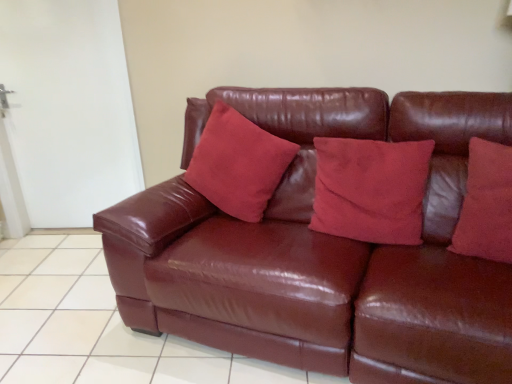
The width and height of the screenshot is (512, 384). Describe the element at coordinates (486, 204) in the screenshot. I see `suede-like red pillow at right, the third pillow from the left` at that location.

The image size is (512, 384). Describe the element at coordinates (323, 250) in the screenshot. I see `shiny brown leather couch at center` at that location.

What is the approximate height of suede-like red pillow at center, the second pillow in the left-to-right sequence?

21.82 inches.

You are a GUI agent. You are given a task and a screenshot of the screen. Output one action in this format:
    pyautogui.click(x=<x>, y=<y>)
    Task: Click on the suede-like red pillow at right, which is counted as the 1th pillow, starting from the right
    The width and height of the screenshot is (512, 384).
    Given the screenshot: What is the action you would take?
    pyautogui.click(x=486, y=204)

Is shiny brown leather couch at center to the right of suede-like red pillow at right, which is counted as the 1th pillow, starting from the right, from the viewer's perspective?

In fact, shiny brown leather couch at center is to the left of suede-like red pillow at right, which is counted as the 1th pillow, starting from the right.

From a real-world perspective, which object stands above the other?

suede-like red pillow at right, the third pillow from the left, is physically above.

Could you tell me if shiny brown leather couch at center is facing suede-like red pillow at right, the third pillow from the left?

No, shiny brown leather couch at center is not aimed at suede-like red pillow at right, the third pillow from the left.

Considering the sizes of objects shiny brown leather couch at center and suede-like red pillow at right, the third pillow from the left, in the image provided, who is bigger, shiny brown leather couch at center or suede-like red pillow at right, the third pillow from the left,?

With larger size is shiny brown leather couch at center.

Is glossy leather couch at center wider than suede-like red pillow at center, the 3th pillow when ordered from right to left?

Correct, the width of glossy leather couch at center exceeds that of suede-like red pillow at center, the 3th pillow when ordered from right to left.

Looking at this image, in terms of height, does glossy leather couch at center look taller or shorter compared to suede-like red pillow at center, the 3th pillow when ordered from right to left?

Considering their sizes, glossy leather couch at center has less height than suede-like red pillow at center, the 3th pillow when ordered from right to left.

Is suede-like red pillow at center, arranged as the 1th pillow when viewed from the left, a part of shiny brown leather couch at center?

Absolutely, suede-like red pillow at center, arranged as the 1th pillow when viewed from the left, is inside shiny brown leather couch at center.

From a real-world perspective, which object rests below the other?

shiny brown leather couch at center is physically lower.

Considering the sizes of objects shiny brown leather couch at center and suede-like red pillow at center, the 3th pillow when ordered from right to left, in the image provided, who is shorter, shiny brown leather couch at center or suede-like red pillow at center, the 3th pillow when ordered from right to left,?

suede-like red pillow at center, the 3th pillow when ordered from right to left, is shorter.

Between shiny brown leather couch at center and suede-like red pillow at center, arranged as the 1th pillow when viewed from the left, which one has smaller width?

Thinner between the two is suede-like red pillow at center, arranged as the 1th pillow when viewed from the left.

Does shiny brown leather couch at center have a lesser height compared to glossy leather couch at center?

No, shiny brown leather couch at center is not shorter than glossy leather couch at center.

Is shiny brown leather couch at center wider or thinner than glossy leather couch at center?

Considering their sizes, shiny brown leather couch at center looks slimmer than glossy leather couch at center.

In the scene shown: Between shiny brown leather couch at center and glossy leather couch at center, which one is positioned behind?

glossy leather couch at center is more distant.

From the picture: Can you confirm if shiny brown leather couch at center is positioned to the left of glossy leather couch at center?

No.

Considering the relative sizes of suede-like red pillow at right, which is counted as the 1th pillow, starting from the right, and glossy leather couch at center in the image provided, is suede-like red pillow at right, which is counted as the 1th pillow, starting from the right, bigger than glossy leather couch at center?

Incorrect, suede-like red pillow at right, which is counted as the 1th pillow, starting from the right, is not larger than glossy leather couch at center.

In the image, is suede-like red pillow at right, the third pillow from the left, on the left side or the right side of glossy leather couch at center?

suede-like red pillow at right, the third pillow from the left, is to the right of glossy leather couch at center.

Is glossy leather couch at center at the back of suede-like red pillow at right, which is counted as the 1th pillow, starting from the right?

No.

Who is taller, suede-like red pillow at right, which is counted as the 1th pillow, starting from the right, or glossy leather couch at center?

Standing taller between the two is suede-like red pillow at right, which is counted as the 1th pillow, starting from the right.

Where is `studio couch located on the left of suede-like red pillow at right, the third pillow from the left`? The image size is (512, 384). studio couch located on the left of suede-like red pillow at right, the third pillow from the left is located at coordinates (323, 250).

Is suede-like red pillow at right, which is counted as the 1th pillow, starting from the right, facing away from shiny brown leather couch at center?

Yes, suede-like red pillow at right, which is counted as the 1th pillow, starting from the right,'s orientation is away from shiny brown leather couch at center.

How many degrees apart are the facing directions of suede-like red pillow at right, which is counted as the 1th pillow, starting from the right, and shiny brown leather couch at center?

They differ by 0.923 degrees in their facing directions.

How many degrees apart are the facing directions of suede-like red pillow at center, arranged as the 1th pillow when viewed from the left, and suede-like red pillow at center, the second pillow in the left-to-right sequence?

The angular difference between suede-like red pillow at center, arranged as the 1th pillow when viewed from the left, and suede-like red pillow at center, the second pillow in the left-to-right sequence, is 4.2 degrees.

From the picture: Which object is positioned more to the right, suede-like red pillow at center, the 3th pillow when ordered from right to left, or suede-like red pillow at center, the second pillow in the left-to-right sequence?

Positioned to the right is suede-like red pillow at center, the second pillow in the left-to-right sequence.

At what (x,y) coordinates should I click in order to perform the action: click on the 2nd pillow directly beneath the suede-like red pillow at center, the 3th pillow when ordered from right to left (from a real-world perspective). Please return your answer as a coordinate pair (x, y). The width and height of the screenshot is (512, 384). Looking at the image, I should click on (370, 189).

Does suede-like red pillow at center, the 3th pillow when ordered from right to left, come behind suede-like red pillow at center, the second pillow in the left-to-right sequence?

Yes, it is.

The image size is (512, 384). In order to click on pillow that is the 2nd object above the shiny brown leather couch at center (from a real-world perspective) in this screenshot , I will do `click(486, 204)`.

In order to click on tile lying below the suede-like red pillow at center, arranged as the 1th pillow when viewed from the left (from the image's perspective) in this screenshot , I will do `click(94, 326)`.

From the picture: When comparing their distances from suede-like red pillow at center, the second pillow in the left-to-right sequence, does suede-like red pillow at center, the 3th pillow when ordered from right to left, or glossy leather couch at center seem closer?

The object closer to suede-like red pillow at center, the second pillow in the left-to-right sequence, is suede-like red pillow at center, the 3th pillow when ordered from right to left.

Consider the image. Based on their spatial positions, is suede-like red pillow at center, the second pillow in the left-to-right sequence, or suede-like red pillow at center, arranged as the 1th pillow when viewed from the left, closer to shiny brown leather couch at center?

The object closer to shiny brown leather couch at center is suede-like red pillow at center, the second pillow in the left-to-right sequence.

Considering their positions, is glossy leather couch at center positioned closer to suede-like red pillow at center, arranged as the 1th pillow when viewed from the left, than suede-like red pillow at right, the third pillow from the left?

glossy leather couch at center is positioned closer to the anchor suede-like red pillow at center, arranged as the 1th pillow when viewed from the left.

Considering their positions, is shiny brown leather couch at center positioned further to suede-like red pillow at center, which is the second pillow from right to left, than glossy leather couch at center?

glossy leather couch at center lies further to suede-like red pillow at center, which is the second pillow from right to left, than the other object.

Based on their spatial positions, is suede-like red pillow at center, the second pillow in the left-to-right sequence, or shiny brown leather couch at center further from suede-like red pillow at center, arranged as the 1th pillow when viewed from the left?

suede-like red pillow at center, the second pillow in the left-to-right sequence.

Considering their positions, is suede-like red pillow at center, which is the second pillow from right to left, positioned further to shiny brown leather couch at center than glossy leather couch at center?

glossy leather couch at center.

From the image, which object appears to be farther from glossy leather couch at center, shiny brown leather couch at center or suede-like red pillow at right, the third pillow from the left?

Based on the image, suede-like red pillow at right, the third pillow from the left, appears to be further to glossy leather couch at center.

Based on their spatial positions, is glossy leather couch at center or suede-like red pillow at center, which is the second pillow from right to left, closer to shiny brown leather couch at center?

Among the two, suede-like red pillow at center, which is the second pillow from right to left, is located nearer to shiny brown leather couch at center.

The image size is (512, 384). In order to click on pillow between suede-like red pillow at center, arranged as the 1th pillow when viewed from the left, and suede-like red pillow at right, the third pillow from the left, from left to right in this screenshot , I will do pyautogui.click(x=370, y=189).

I want to click on studio couch between suede-like red pillow at center, the 3th pillow when ordered from right to left, and suede-like red pillow at right, which is counted as the 1th pillow, starting from the right, so click(323, 250).

I want to click on studio couch between glossy leather couch at center and suede-like red pillow at center, which is the second pillow from right to left, from left to right, so click(323, 250).

Identify the location of pillow located between glossy leather couch at center and suede-like red pillow at center, which is the second pillow from right to left, in the left-right direction. (238, 164).